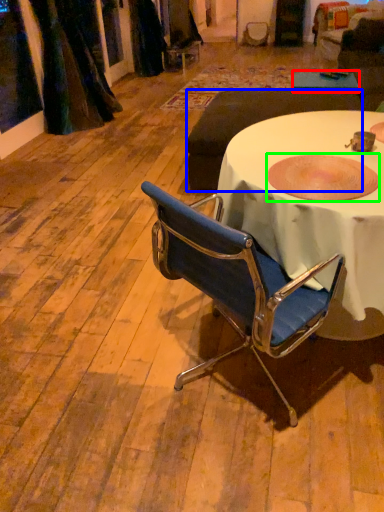
Question: Based on their relative distances, which object is nearer to table (highlighted by a red box)? Choose from studio couch (highlighted by a blue box) and bowl (highlighted by a green box).

Choices:
 (A) studio couch
 (B) bowl

Answer: (A)